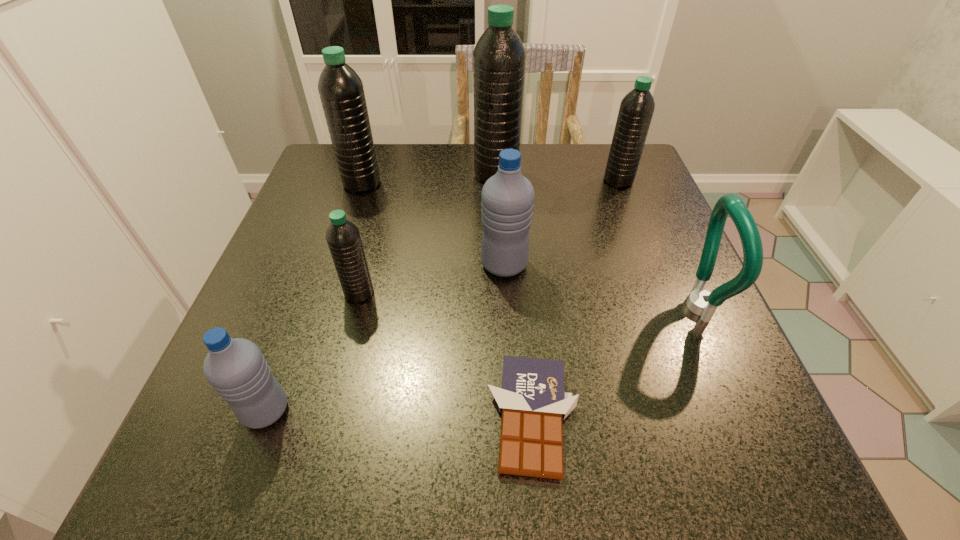
Image resolution: width=960 pixels, height=540 pixels. I want to click on free space between the second tallest water bottle and the shortest object, so click(x=447, y=300).

This screenshot has width=960, height=540. What are the coordinates of `free area in between the seventh shortest object and the farther blue water bottle` in the screenshot? It's located at (433, 224).

The image size is (960, 540). In order to click on vacant space that's between the seventh shortest object and the nearer blue water bottle in this screenshot , I will do `click(314, 297)`.

Identify the location of free point between the chocolate bar and the second tallest water bottle. This screenshot has width=960, height=540. click(447, 300).

You are a GUI agent. You are given a task and a screenshot of the screen. Output one action in this format:
    pyautogui.click(x=<x>, y=<y>)
    Task: Click on the empty location between the chocolate bar and the fourth farthest water bottle
    
    Given the screenshot: What is the action you would take?
    pyautogui.click(x=518, y=340)

Select which object appears as the closest to the seventh shortest object. Please provide its 2D coordinates. Your answer should be formatted as a tuple, i.e. [(x, y)], where the tuple contains the x and y coordinates of a point satisfying the conditions above.

[(499, 57)]

Where is `object that is the third closest to the shortest object`? The height and width of the screenshot is (540, 960). object that is the third closest to the shortest object is located at coordinates (343, 237).

Select which water bottle is the second closest to the bottle opener. Please provide its 2D coordinates. Your answer should be formatted as a tuple, i.e. [(x, y)], where the tuple contains the x and y coordinates of a point satisfying the conditions above.

[(636, 109)]

Identify which water bottle is located as the second nearest to the shortest object. Please provide its 2D coordinates. Your answer should be formatted as a tuple, i.e. [(x, y)], where the tuple contains the x and y coordinates of a point satisfying the conditions above.

[(343, 237)]

Identify which black water bottle is the closest to the bottle opener. Please provide its 2D coordinates. Your answer should be formatted as a tuple, i.e. [(x, y)], where the tuple contains the x and y coordinates of a point satisfying the conditions above.

[(636, 109)]